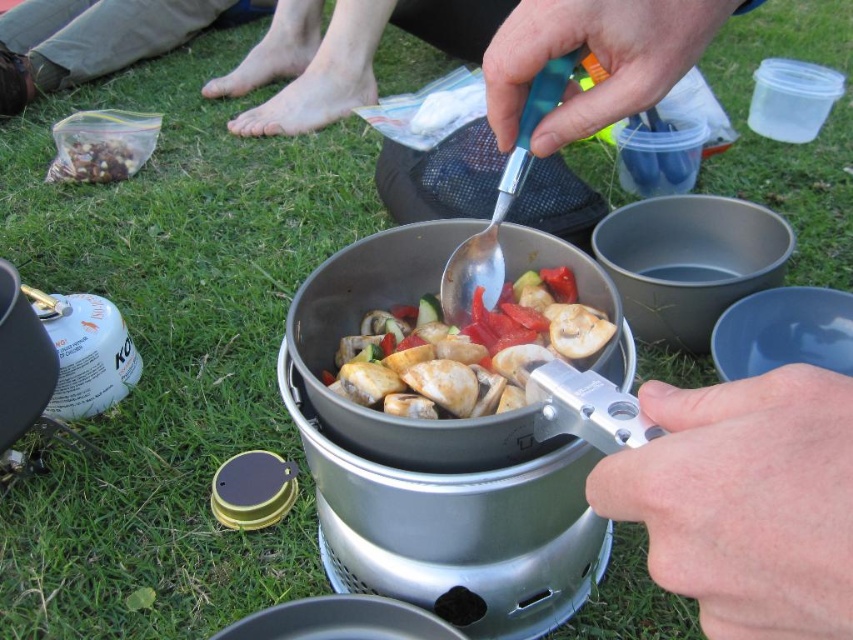
Is metallic silver knife at center to the left of teal plastic spoon at upper center from the viewer's perspective?

No, metallic silver knife at center is not to the left of teal plastic spoon at upper center.

Who is positioned more to the left, metallic silver knife at center or teal plastic spoon at upper center?

teal plastic spoon at upper center is more to the left.

This screenshot has width=853, height=640. What are the coordinates of `metallic silver knife at center` in the screenshot? It's located at (746, 500).

Does shiny metallic mushrooms at center appear over brown crumbly mix at upper left?

Actually, shiny metallic mushrooms at center is below brown crumbly mix at upper left.

Which is more to the left, shiny metallic mushrooms at center or brown crumbly mix at upper left?

Positioned to the left is brown crumbly mix at upper left.

Find the location of a particular element. This screenshot has width=853, height=640. shiny metallic mushrooms at center is located at coordinates (466, 349).

Can you confirm if teal plastic spoon at upper center is positioned below barefoot skin at upper center?

Indeed, teal plastic spoon at upper center is positioned under barefoot skin at upper center.

This screenshot has height=640, width=853. Describe the element at coordinates (479, 58) in the screenshot. I see `teal plastic spoon at upper center` at that location.

I want to click on teal plastic spoon at upper center, so click(x=479, y=58).